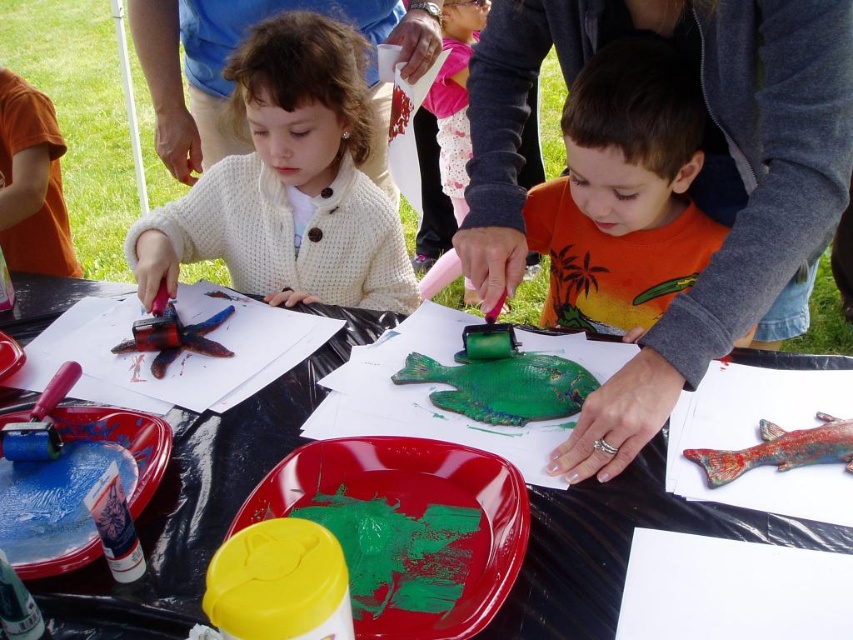
Does point (593, 568) lie in front of point (387, 609)?

That is False.

Who is more forward, (529,596) or (387,589)?

Point (529,596) is in front.

This screenshot has width=853, height=640. In order to click on smooth plastic table at center in this screenshot , I will do [199, 500].

Based on the photo, can you confirm if matte plastic plate at center is positioned above rubber stamp at upper left?

Actually, matte plastic plate at center is below rubber stamp at upper left.

Measure the distance between matte plastic plate at center and camera.

matte plastic plate at center is 19.89 inches from camera.

Where is `matte plastic plate at center`? The height and width of the screenshot is (640, 853). matte plastic plate at center is located at coordinates (407, 529).

Which is more to the right, green matte paint at center or rubber stamp at upper left?

Positioned to the right is green matte paint at center.

Is green matte paint at center wider than rubber stamp at upper left?

Correct, the width of green matte paint at center exceeds that of rubber stamp at upper left.

The height and width of the screenshot is (640, 853). Find the location of `green matte paint at center`. green matte paint at center is located at coordinates (398, 550).